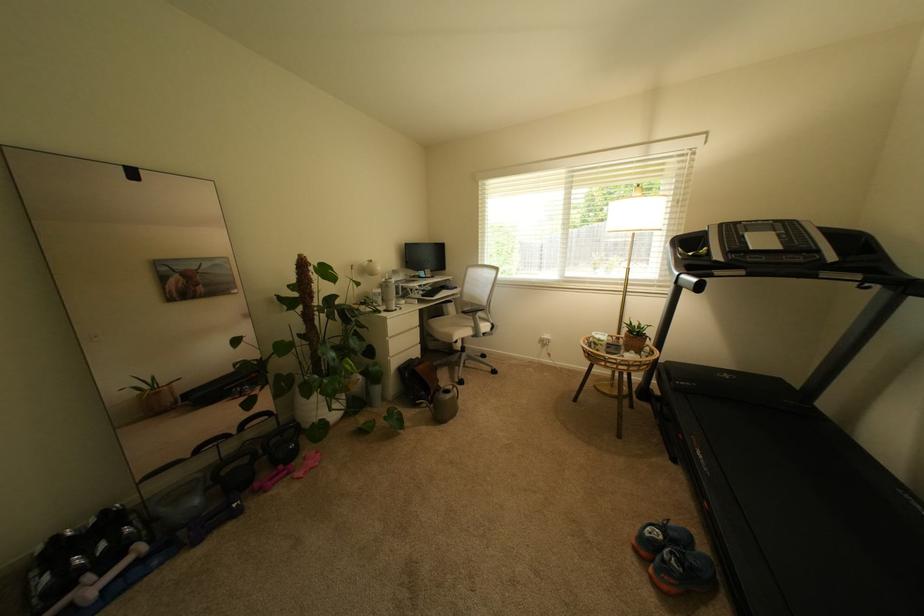
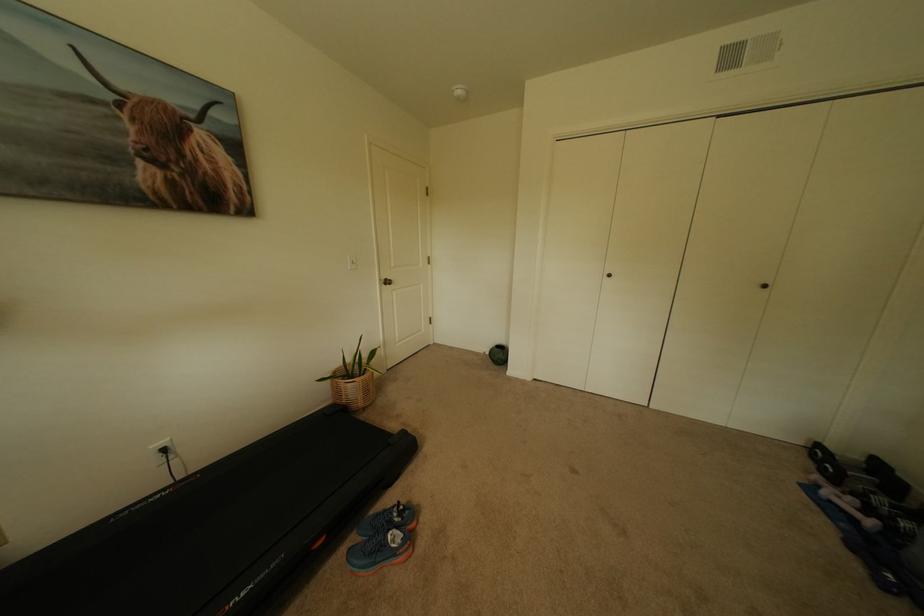
Find the pixel in the second image that matches the point at 144,562 in the first image.

(862, 521)